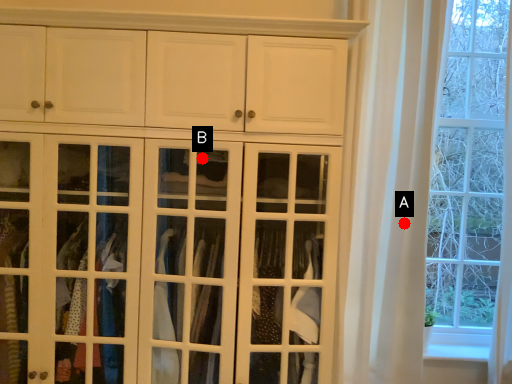
Question: Two points are circled on the image, labeled by A and B beside each circle. Which point is closer to the camera?

Choices:
 (A) A is closer
 (B) B is closer

Answer: (B)